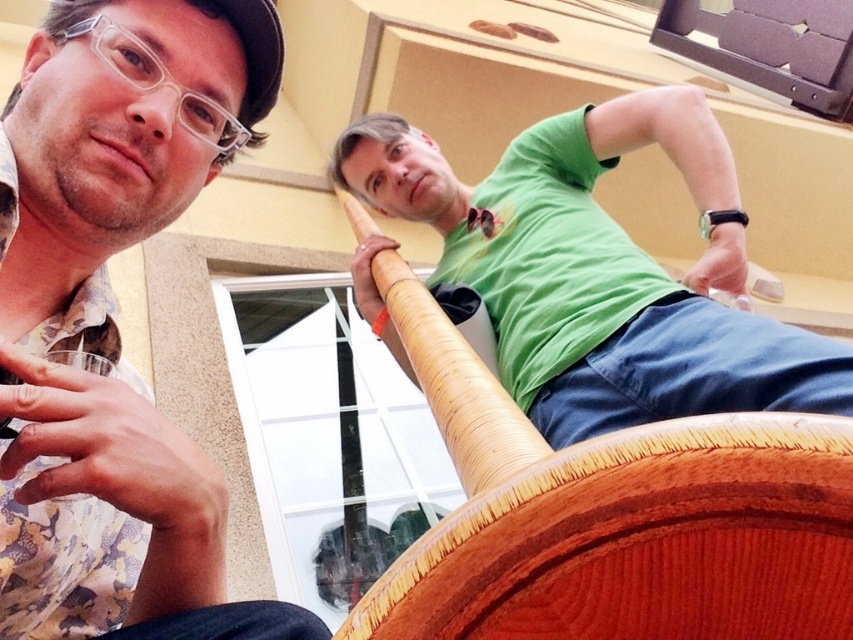
Question: Which of the following is the closest to the observer?

Choices:
 (A) green matte t-shirt at upper center
 (B) wooden chair at upper center

Answer: (B)

Question: Which point is farther from the camera taking this photo?

Choices:
 (A) (434, 182)
 (B) (531, 538)

Answer: (A)

Question: Which object is positioned closest to the wooden chair at upper center?

Choices:
 (A) green matte t-shirt at upper center
 (B) matte floral shirt at left

Answer: (A)

Question: Does matte floral shirt at left come in front of green matte t-shirt at upper center?

Choices:
 (A) no
 (B) yes

Answer: (B)

Question: Considering the relative positions of matte floral shirt at left and wooden chair at upper center in the image provided, where is matte floral shirt at left located with respect to wooden chair at upper center?

Choices:
 (A) right
 (B) left

Answer: (B)

Question: Is matte floral shirt at left below green matte t-shirt at upper center?

Choices:
 (A) no
 (B) yes

Answer: (B)